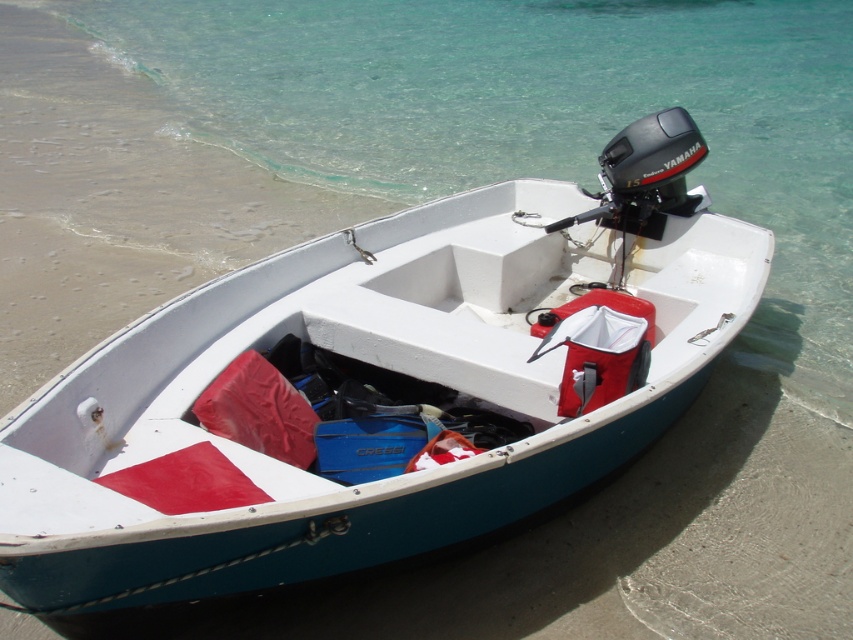
Question: From the image, what is the correct spatial relationship of white matte boat at center in relation to clear water at lower center?

Choices:
 (A) left
 (B) right

Answer: (A)

Question: Is white matte boat at center closer to the viewer compared to clear water at lower center?

Choices:
 (A) no
 (B) yes

Answer: (B)

Question: Which object appears closest to the camera in this image?

Choices:
 (A) clear water at lower center
 (B) white matte boat at center

Answer: (B)

Question: Can you confirm if white matte boat at center is positioned to the left of clear water at lower center?

Choices:
 (A) no
 (B) yes

Answer: (B)

Question: Among these points, which one is nearest to the camera?

Choices:
 (A) (352, 176)
 (B) (607, 436)

Answer: (B)

Question: Among these points, which one is farthest from the camera?

Choices:
 (A) (695, 83)
 (B) (538, 276)

Answer: (A)